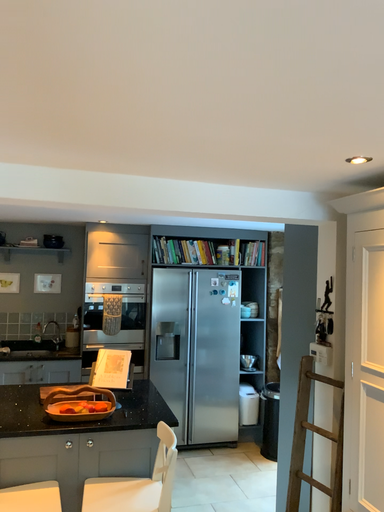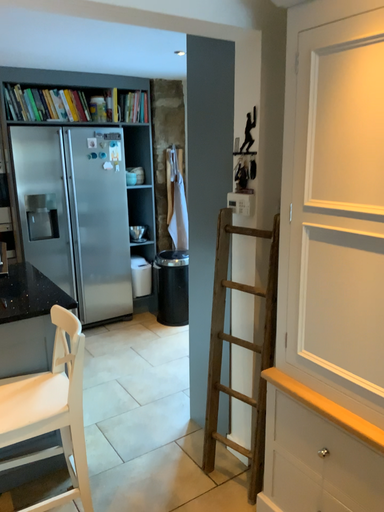
Question: How did the camera likely rotate when shooting the video?

Choices:
 (A) rotated right
 (B) rotated left

Answer: (A)